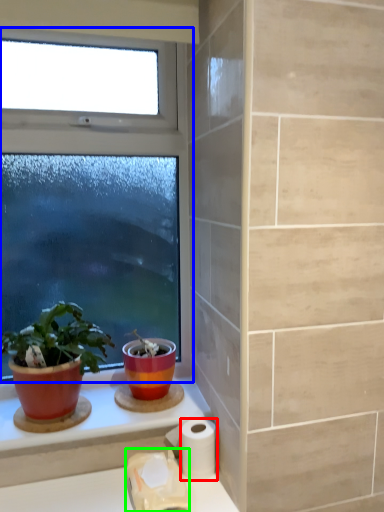
Question: Which object is positioned closest to toilet paper (highlighted by a red box)? Select from window (highlighted by a blue box) and toilet paper (highlighted by a green box).

Choices:
 (A) window
 (B) toilet paper

Answer: (B)